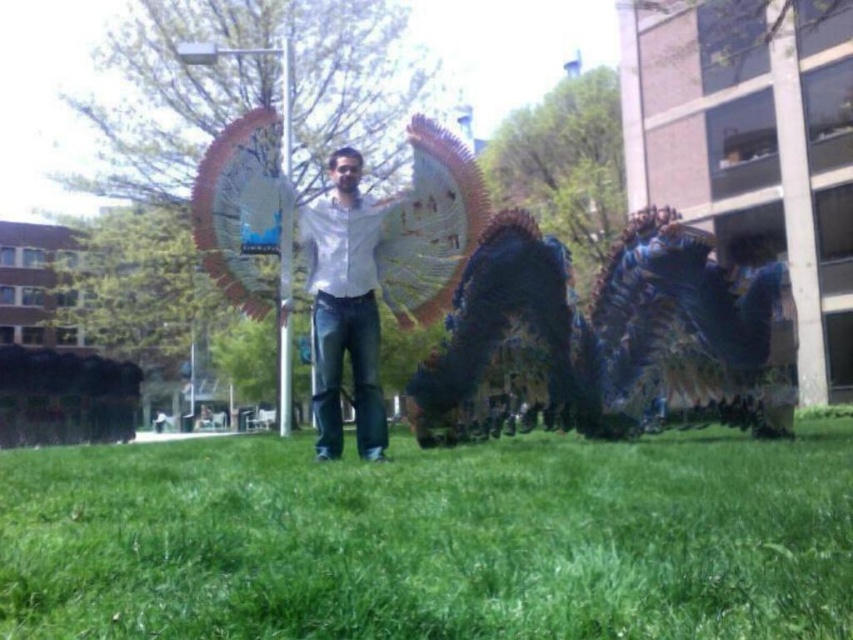
Question: Which point appears closest to the camera in this image?

Choices:
 (A) (647, 531)
 (B) (341, 426)

Answer: (A)

Question: Can you confirm if white matte shirt at center is positioned to the left of metallic pole at center?

Choices:
 (A) yes
 (B) no

Answer: (B)

Question: Which point is closer to the camera?

Choices:
 (A) white matte shirt at center
 (B) metallic pole at center

Answer: (A)

Question: Is green grass at lower center further to camera compared to metallic pole at center?

Choices:
 (A) yes
 (B) no

Answer: (B)

Question: Which of the following is the closest to the observer?

Choices:
 (A) (252, 608)
 (B) (357, 298)

Answer: (A)

Question: Can you confirm if green grass at lower center is positioned to the left of metallic pole at center?

Choices:
 (A) yes
 (B) no

Answer: (B)